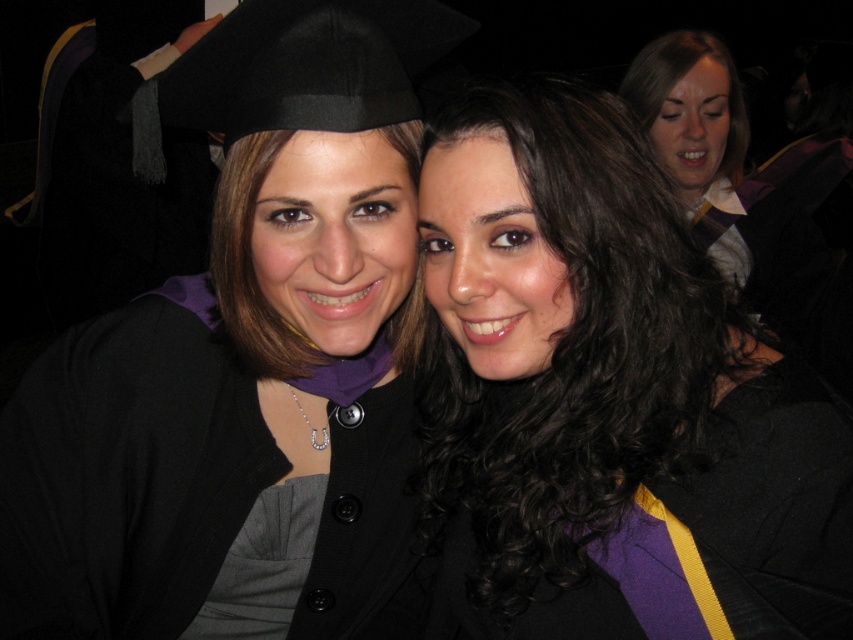
Question: Which object appears closest to the camera in this image?

Choices:
 (A) matte black graduation cap at upper left
 (B) dark brown curly hair at center

Answer: (B)

Question: Is matte black graduation cap at upper left to the left of dark brown curly hair at center from the viewer's perspective?

Choices:
 (A) no
 (B) yes

Answer: (B)

Question: Is matte black graduation cap at upper left below dark brown curly hair at center?

Choices:
 (A) no
 (B) yes

Answer: (A)

Question: From the image, what is the correct spatial relationship of matte black graduation cap at upper left in relation to dark brown curly hair at center?

Choices:
 (A) above
 (B) below

Answer: (A)